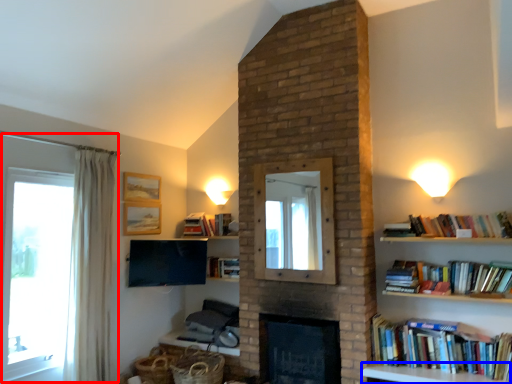
Question: Which object appears closest to the camera in this image, window (highlighted by a red box) or furniture (highlighted by a blue box)?

Choices:
 (A) window
 (B) furniture

Answer: (B)